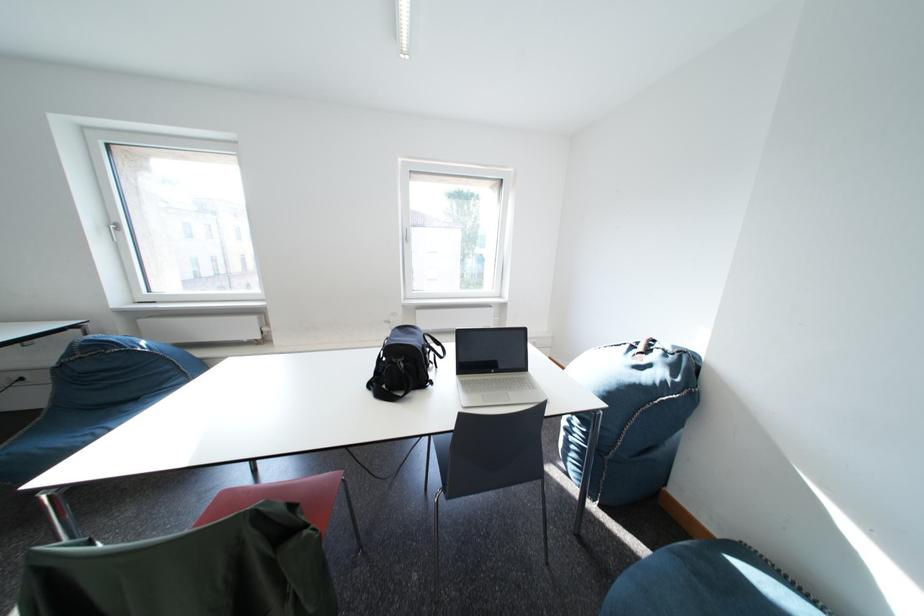
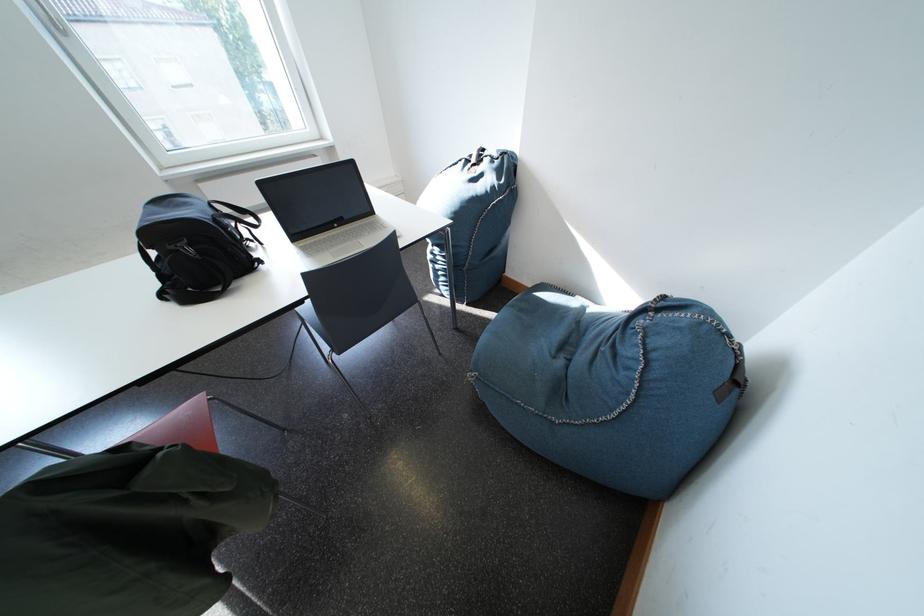
The point at (649, 346) is marked in the first image. Where is the corresponding point in the second image?

(481, 160)